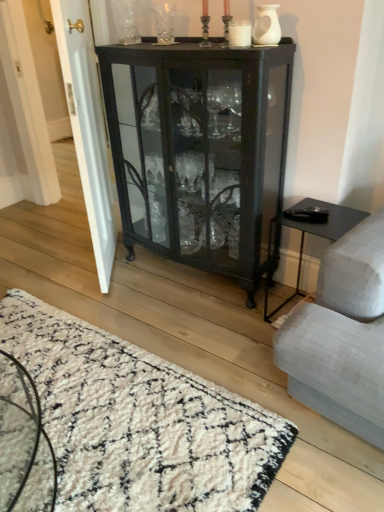
This screenshot has height=512, width=384. In order to click on free space that is in between black glass cabinet at center and white glossy door at left in this screenshot , I will do `click(157, 292)`.